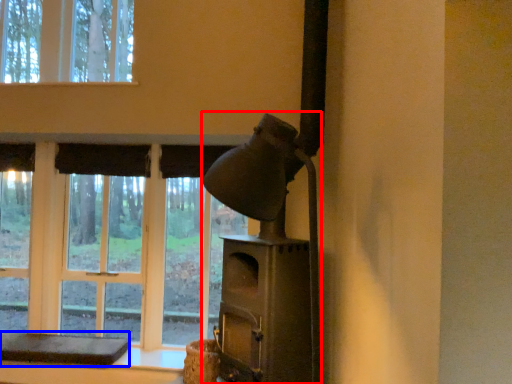
Question: Which object is further to the camera taking this photo, fireplace (highlighted by a red box) or furniture (highlighted by a blue box)?

Choices:
 (A) fireplace
 (B) furniture

Answer: (B)